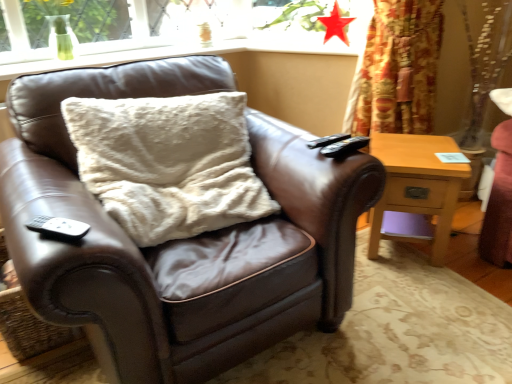
At what (x,y) coordinates should I click in order to perform the action: click on matte red star at upper center. Please return your answer as a coordinate pair (x, y). The height and width of the screenshot is (384, 512). Looking at the image, I should click on (335, 24).

At what (x,y) coordinates should I click in order to perform the action: click on fuzzy white pillow at center. Please return your answer as a coordinate pair (x, y). The width and height of the screenshot is (512, 384). Looking at the image, I should click on (168, 163).

Where is `black plastic remote at upper right, acting as the first remote starting from the right`? The image size is (512, 384). black plastic remote at upper right, acting as the first remote starting from the right is located at coordinates (341, 144).

In order to face brown leather chair at center, should I rotate leftwards or rightwards?

You should look left and rotate roughly 10.354 degrees.

Describe the element at coordinates (183, 239) in the screenshot. I see `brown leather chair at center` at that location.

You are a GUI agent. You are given a task and a screenshot of the screen. Output one action in this format:
    pyautogui.click(x=<x>, y=<y>)
    Task: Click on the matte red star at upper center
    Image resolution: width=512 pixels, height=384 pixels.
    Given the screenshot: What is the action you would take?
    pyautogui.click(x=335, y=24)

Locate an element on the screen. The image size is (512, 384). nightstand on the right of the black plastic remote at upper right, acting as the first remote starting from the right is located at coordinates (417, 189).

Is light wood/texture nightstand at right wider or thinner than black plastic remote at upper right, acting as the first remote starting from the right?

Considering their sizes, light wood/texture nightstand at right looks broader than black plastic remote at upper right, acting as the first remote starting from the right.

Is light wood/texture nightstand at right in contact with black plastic remote at upper right, the 2th remote in the bottom-to-top sequence?

No.

In the image, is light wood/texture nightstand at right positioned in front of or behind black plastic remote at upper right, the 2th remote from the left?

In the image, light wood/texture nightstand at right appears behind black plastic remote at upper right, the 2th remote from the left.

Which of these two, black plastic remote at upper right, the 1th remote when ordered from top to bottom, or matte red star at upper center, stands taller?

With more height is matte red star at upper center.

Is black plastic remote at upper right, which appears as the first remote when viewed from the back, aimed at matte red star at upper center?

No, black plastic remote at upper right, which appears as the first remote when viewed from the back, is not facing towards matte red star at upper center.

Would you say black plastic remote at upper right, the second remote from the front, is inside or outside matte red star at upper center?

black plastic remote at upper right, the second remote from the front, is not enclosed by matte red star at upper center.

From a real-world perspective, is black plastic remote at upper right, the 2th remote from the left, positioned above or below matte red star at upper center?

In terms of real-world spatial position, black plastic remote at upper right, the 2th remote from the left, is below matte red star at upper center.

How far apart are black plastic remote at upper right, acting as the first remote starting from the right, and fuzzy white pillow at center?

black plastic remote at upper right, acting as the first remote starting from the right, is 19.07 inches from fuzzy white pillow at center.

From the image's perspective, relative to fuzzy white pillow at center, is black plastic remote at upper right, the 2th remote from the left, above or below?

black plastic remote at upper right, the 2th remote from the left, is above fuzzy white pillow at center.

How different are the orientations of black plastic remote at upper right, the 2th remote in the bottom-to-top sequence, and fuzzy white pillow at center in degrees?

There is a 9.17-degree angle between the facing directions of black plastic remote at upper right, the 2th remote in the bottom-to-top sequence, and fuzzy white pillow at center.

Is black plastic remote at upper right, the 1th remote when ordered from top to bottom, wider than fuzzy white pillow at center?

No, black plastic remote at upper right, the 1th remote when ordered from top to bottom, is not wider than fuzzy white pillow at center.

Is point (353, 138) closer to viewer compared to point (42, 223)?

No, (353, 138) is further to viewer.

From the image's perspective, is black plastic remote at upper right, the 2th remote in the bottom-to-top sequence, located beneath black matte remote at lower left, marked as the 1th remote in a front-to-back arrangement?

Actually, black plastic remote at upper right, the 2th remote in the bottom-to-top sequence, appears above black matte remote at lower left, marked as the 1th remote in a front-to-back arrangement, in the image.

Which of these two, black plastic remote at upper right, which appears as the first remote when viewed from the back, or black matte remote at lower left, the second remote positioned from the top, is wider?

With larger width is black matte remote at lower left, the second remote positioned from the top.

Which object is closer to the camera, black plastic remote at upper right, the second remote from the front, or black matte remote at lower left, which ranks as the first remote in left-to-right order?

black matte remote at lower left, which ranks as the first remote in left-to-right order.

Considering the relative sizes of light wood/texture nightstand at right and brown leather chair at center in the image provided, is light wood/texture nightstand at right thinner than brown leather chair at center?

Yes.

Is light wood/texture nightstand at right facing towards brown leather chair at center?

No, light wood/texture nightstand at right does not turn towards brown leather chair at center.

Does point (443, 249) appear closer or farther from the camera than point (259, 335)?

Point (443, 249) is farther from the camera than point (259, 335).

Are light wood/texture nightstand at right and brown leather chair at center located far from each other?

light wood/texture nightstand at right is actually quite close to brown leather chair at center.

Which point is more forward, (223, 118) or (331, 29)?

Point (223, 118)

From a real-world perspective, is fuzzy white pillow at center located beneath matte red star at upper center?

Indeed, from a real-world perspective, fuzzy white pillow at center is positioned beneath matte red star at upper center.

Who is shorter, fuzzy white pillow at center or matte red star at upper center?

matte red star at upper center.

Considering the relative sizes of fuzzy white pillow at center and matte red star at upper center in the image provided, is fuzzy white pillow at center smaller than matte red star at upper center?

No, fuzzy white pillow at center is not smaller than matte red star at upper center.

Between brown leather chair at center and light wood/texture nightstand at right, which one is positioned in front?

brown leather chair at center is in front.

Is brown leather chair at center bigger than light wood/texture nightstand at right?

Yes, brown leather chair at center is bigger than light wood/texture nightstand at right.

What are the coordinates of `nightstand on the right of black plastic remote at upper right, acting as the first remote starting from the right` in the screenshot? It's located at (x=417, y=189).

This screenshot has height=384, width=512. In order to click on remote that is the 1st one when counting leftward from the matte red star at upper center in this screenshot , I will do `click(341, 144)`.

From the picture: From the image, which object appears to be nearer to black plastic remote at upper right, which appears as the first remote when viewed from the back, brown leather chair at center or matte red star at upper center?

Based on the image, brown leather chair at center appears to be nearer to black plastic remote at upper right, which appears as the first remote when viewed from the back.

When comparing their distances from black matte remote at lower left, marked as the 1th remote in a front-to-back arrangement, does fuzzy white pillow at center or light wood/texture nightstand at right seem closer?

fuzzy white pillow at center.

Looking at the image, which one is located closer to light wood/texture nightstand at right, black matte remote at lower left, marked as the 1th remote in a front-to-back arrangement, or black plastic remote at upper right, acting as the first remote starting from the right?

black plastic remote at upper right, acting as the first remote starting from the right, is positioned closer to the anchor light wood/texture nightstand at right.

Estimate the real-world distances between objects in this image. Which object is closer to matte red star at upper center, black matte remote at lower left, the second remote positioned from the top, or brown leather chair at center?

Among the two, brown leather chair at center is located nearer to matte red star at upper center.

Looking at the image, which one is located closer to light wood/texture nightstand at right, brown leather chair at center or black plastic remote at upper right, which appears as the first remote when viewed from the back?

black plastic remote at upper right, which appears as the first remote when viewed from the back, is closer to light wood/texture nightstand at right.

When comparing their distances from black plastic remote at upper right, acting as the first remote starting from the right, does black matte remote at lower left, which ranks as the first remote in left-to-right order, or matte red star at upper center seem closer?

black matte remote at lower left, which ranks as the first remote in left-to-right order, is positioned closer to the anchor black plastic remote at upper right, acting as the first remote starting from the right.

Estimate the real-world distances between objects in this image. Which object is closer to matte red star at upper center, fuzzy white pillow at center or brown leather chair at center?

The object closer to matte red star at upper center is fuzzy white pillow at center.

Looking at the image, which one is located closer to brown leather chair at center, light wood/texture nightstand at right or matte red star at upper center?

light wood/texture nightstand at right lies closer to brown leather chair at center than the other object.

Image resolution: width=512 pixels, height=384 pixels. In order to click on nightstand between black matte remote at lower left, the second remote positioned from the top, and matte red star at upper center in the front-back direction in this screenshot , I will do `click(417, 189)`.

Find the location of a particular element. The width and height of the screenshot is (512, 384). pillow situated between brown leather chair at center and light wood/texture nightstand at right from left to right is located at coordinates (168, 163).

Find the location of `nightstand located between brown leather chair at center and matte red star at upper center in the depth direction`. nightstand located between brown leather chair at center and matte red star at upper center in the depth direction is located at coordinates (417, 189).

Identify the location of remote that lies between matte red star at upper center and light wood/texture nightstand at right from top to bottom. Image resolution: width=512 pixels, height=384 pixels. (341, 144).